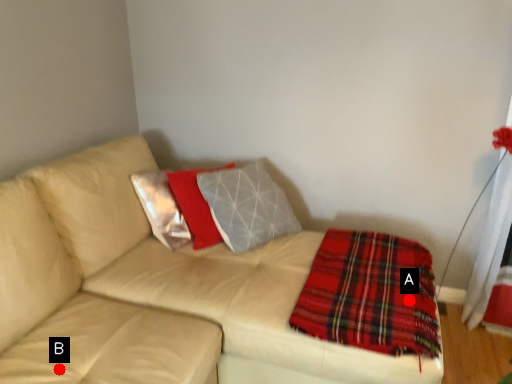
Question: Two points are circled on the image, labeled by A and B beside each circle. Which point is farther from the camera taking this photo?

Choices:
 (A) A is further
 (B) B is further

Answer: (A)